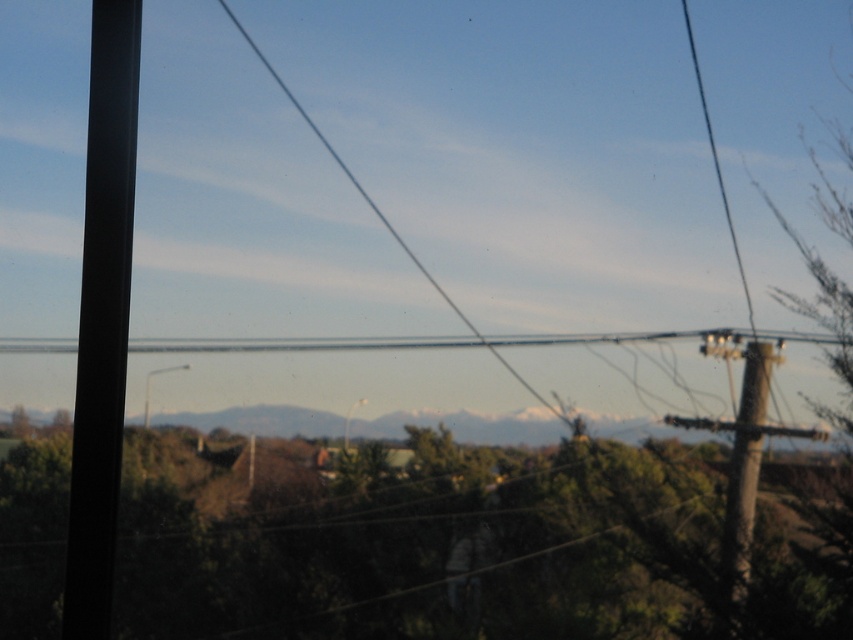
You are standing at the center of the image and want to walk towards the green leafy tree at center. Which direction should you move to reach it?

The green leafy tree at center is located at point [419,541], so you should move towards the right and slightly forward to reach it.

You are standing in the rural landscape scene and want to determine which of the two points, point (676, 634) or point (735, 509), is nearer to you. Based on the scene description, can you identify the closer point?

Point (676, 634) is closer to the camera than point (735, 509), so it is the nearer point.

You are a bird looking for a place to perch. You see a green leafy tree at center and a brown rough wood telegraph pole at right. Which one is taller and would allow you to see farther?

The brown rough wood telegraph pole at right is taller than the green leafy tree at center, so perching there would provide a better vantage point to see farther.